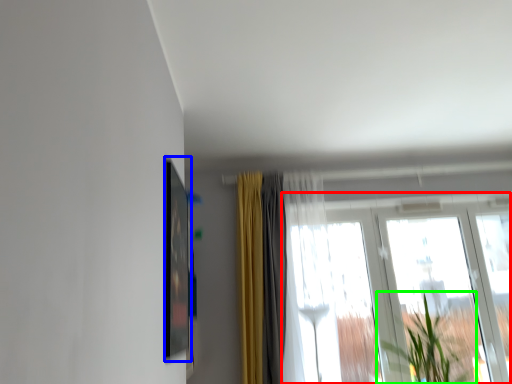
Question: Which is farther away from window (highlighted by a red box)? picture frame (highlighted by a blue box) or houseplant (highlighted by a green box)?

Choices:
 (A) picture frame
 (B) houseplant

Answer: (A)